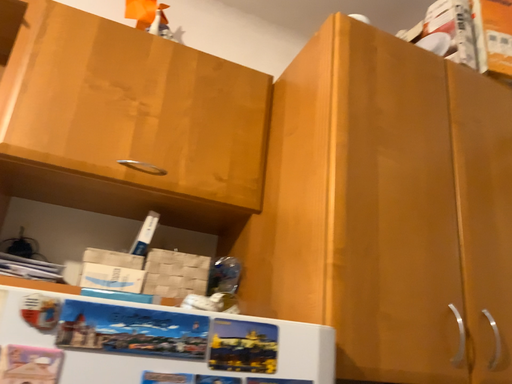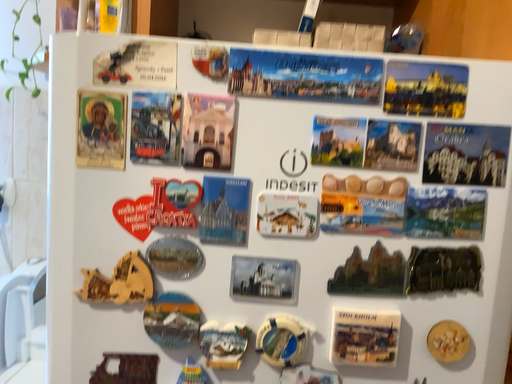
Question: How did the camera likely rotate when shooting the video?

Choices:
 (A) rotated upward
 (B) rotated downward

Answer: (B)